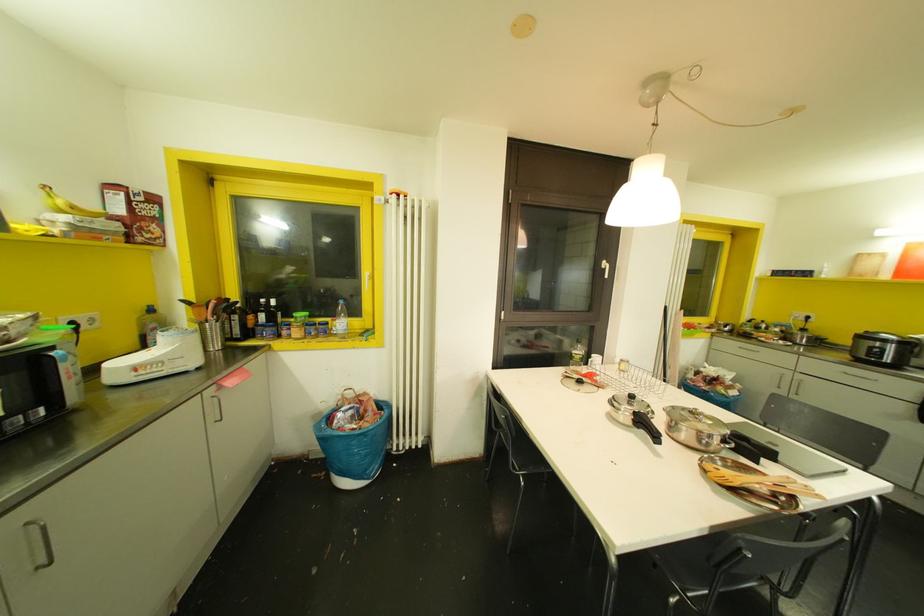
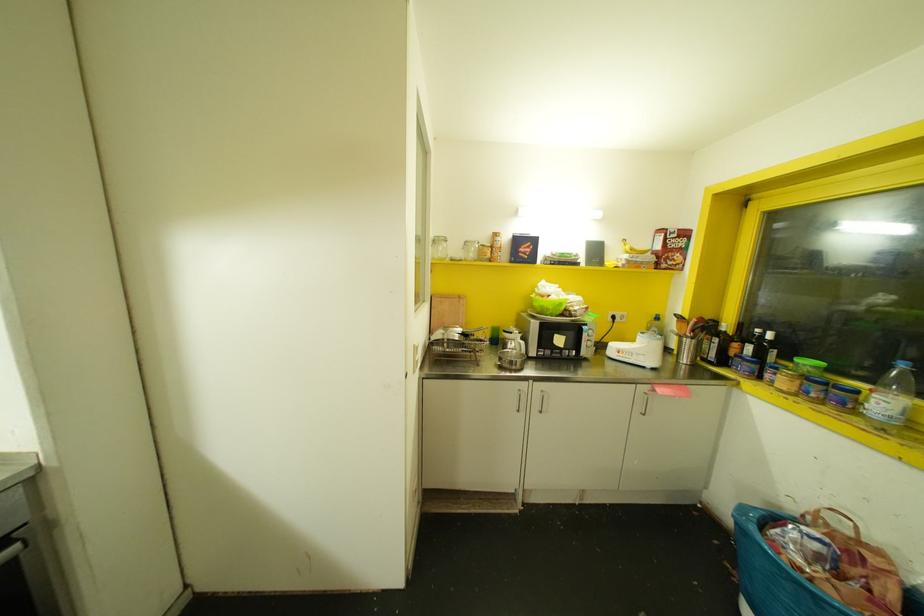
Locate, in the second image, the point that corresponds to (x=330, y=416) in the first image.

(773, 517)